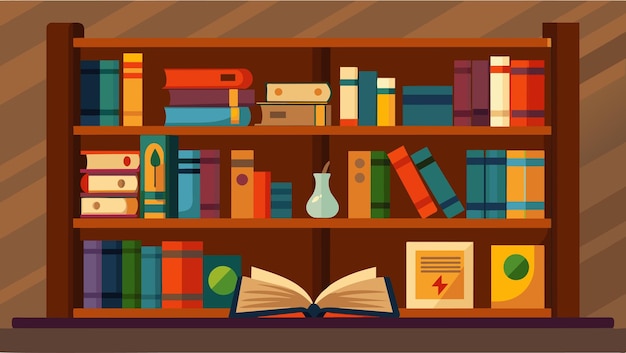
The image size is (626, 353). Find the location of `books on bottom shelf`. books on bottom shelf is located at coordinates (91, 285), (106, 283), (131, 286), (150, 287), (173, 283), (188, 285), (212, 285), (314, 312), (442, 279), (516, 276).